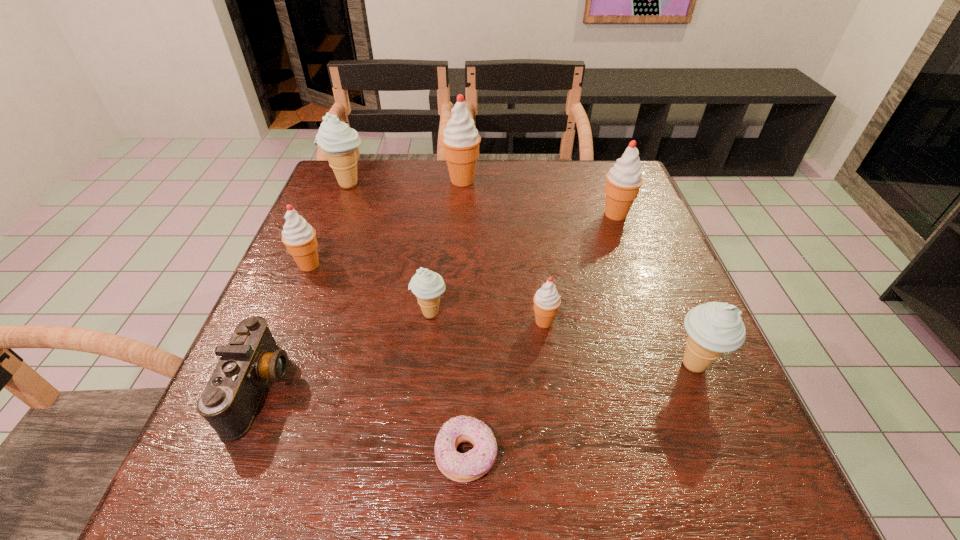
You are a GUI agent. You are given a task and a screenshot of the screen. Output one action in this format:
    pyautogui.click(x=<x>, y=<y>)
    Task: Click on the blank space located on the right of the second nearest red icecream
    The height and width of the screenshot is (540, 960).
    Given the screenshot: What is the action you would take?
    pyautogui.click(x=394, y=265)

The height and width of the screenshot is (540, 960). I want to click on free location located 0.160m on the back of the nearest beige icecream, so [x=661, y=286].

In order to click on vacant space located on the left of the second nearest beige icecream in this screenshot , I will do `click(283, 313)`.

The width and height of the screenshot is (960, 540). I want to click on vacant space located 0.400m on the back of the nearest red icecream, so click(528, 202).

Find the location of `free point located 0.210m on the lens of the eighth tallest object`. free point located 0.210m on the lens of the eighth tallest object is located at coordinates (404, 388).

I want to click on free space located 0.360m on the right of the doughnut, so click(723, 455).

Locate an element on the screen. Image resolution: width=960 pixels, height=540 pixels. object that is positioned at the near edge is located at coordinates (469, 466).

You are a GUI agent. You are given a task and a screenshot of the screen. Output one action in this format:
    pyautogui.click(x=<x>, y=<y>)
    Task: Click on the camera that is at the left edge
    This screenshot has height=540, width=960.
    Given the screenshot: What is the action you would take?
    pyautogui.click(x=231, y=398)

Where is `object located in the far left corner section of the desktop`? object located in the far left corner section of the desktop is located at coordinates (339, 142).

You are a GUI agent. You are given a task and a screenshot of the screen. Output one action in this format:
    pyautogui.click(x=<x>, y=<y>)
    Task: Click on the object that is at the far right corner
    
    Given the screenshot: What is the action you would take?
    pyautogui.click(x=624, y=180)